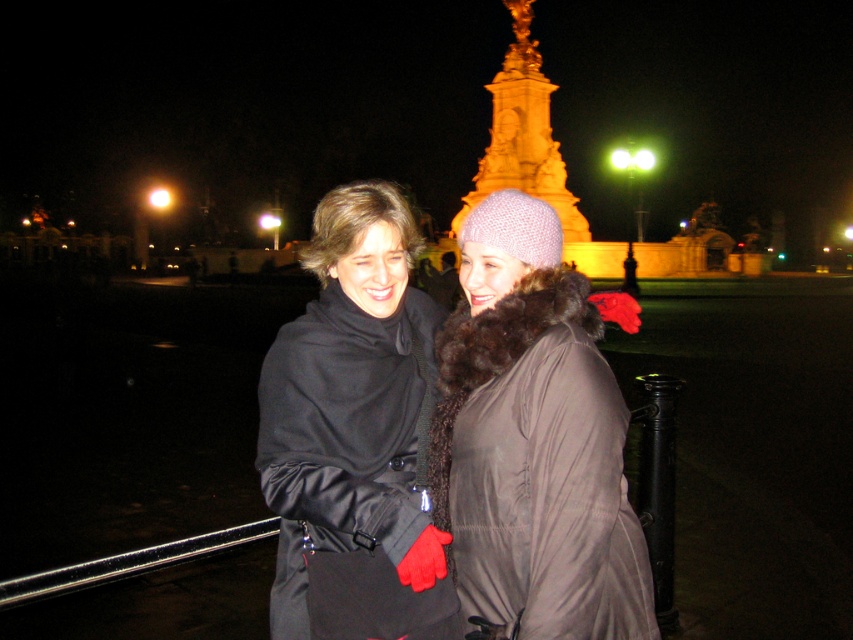
You are a photographer trying to capture a photo of the knitted woolen hat at center and the gold polished stone tower at upper center. Which object should you focus on first if you want to ensure both are in sharp focus?

The knitted woolen hat at center is closer to the camera than the gold polished stone tower at upper center. To ensure both are in focus, you should focus on the gold polished stone tower at upper center first, as it is farther away, allowing the knitted woolen hat at center to fall within the depth of field.

You are a photographer trying to capture both the knitted woolen hat at center and the matte black coat at center in a single frame. Since the camera has a limited depth of field, you need to focus on the smaller object first. Which object should you focus on first?

The knitted woolen hat at center is smaller than the matte black coat at center, so you should focus on the knitted woolen hat at center first to ensure it is in sharp focus within the limited depth of field.

From the picture: You are a photographer trying to capture the two individuals in the scene. You notice a specific point at coordinates point (354,413). Based on the scene description, can you determine which object this point is located on?

The point (354,413) is located on the matte black coat at center.